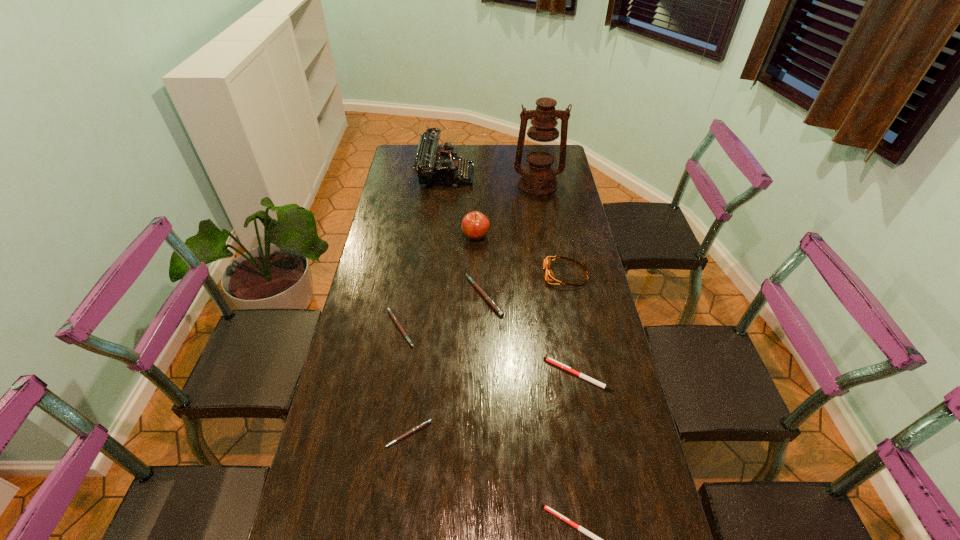
I want to click on the tallest object, so click(x=538, y=178).

The width and height of the screenshot is (960, 540). I want to click on typewriter, so click(435, 165).

Identify the location of apple. (475, 225).

The height and width of the screenshot is (540, 960). I want to click on the seventh shortest object, so click(x=475, y=225).

Image resolution: width=960 pixels, height=540 pixels. I want to click on goggles, so click(549, 276).

Locate an element on the screen. This screenshot has width=960, height=540. the rightmost pink pen is located at coordinates (490, 301).

I want to click on the fifth shortest object, so click(x=490, y=301).

You are a GUI agent. You are given a task and a screenshot of the screen. Output one action in this format:
    pyautogui.click(x=<x>, y=<y>)
    Task: Click on the second biggest pink pen
    
    Given the screenshot: What is the action you would take?
    pyautogui.click(x=392, y=315)

You are a GUI agent. You are given a task and a screenshot of the screen. Output one action in this format:
    pyautogui.click(x=<x>, y=<y>)
    Task: Click on the third nearest pen
    
    Given the screenshot: What is the action you would take?
    pyautogui.click(x=550, y=360)

Locate an element on the screen. the farther white pen is located at coordinates pyautogui.click(x=550, y=360).